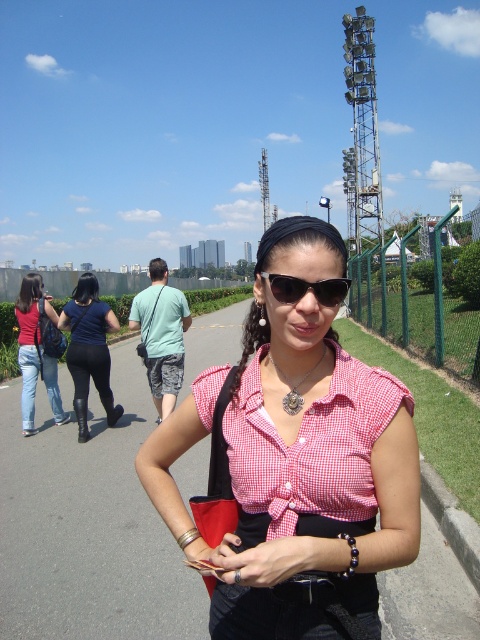
In the scene shown: You are a photographer trying to capture a closeup of the silver metallic pendant at center while also including the pink checkered shirt at center in the frame. Based on their positions, can you determine which side of the pendant the shirt will appear on in the photo?

The pink checkered shirt at center is to the left of the silver metallic pendant at center, so in the photo, the shirt will appear on the left side of the pendant.

You are a fashion designer observing the woman in the scene. You want to create a necklace design that complements her existing accessories. Considering the sizes of the sunglasses at center and the silver metallic pendant at center, which accessory should the necklace be designed to match in size?

The sunglasses at center are larger in size than the silver metallic pendant at center. To create a complementary necklace design, it should be designed to match the size of the silver metallic pendant at center, as it is smaller and would harmonize better with the pendant.

You are a photographer trying to capture a closeup of the black leather boots at left and denim jeans at left. Which object is taller so that you can focus your camera accordingly?

The black leather boots at left is much taller than the denim jeans at left, so you should focus your camera on the black leather boots at left.